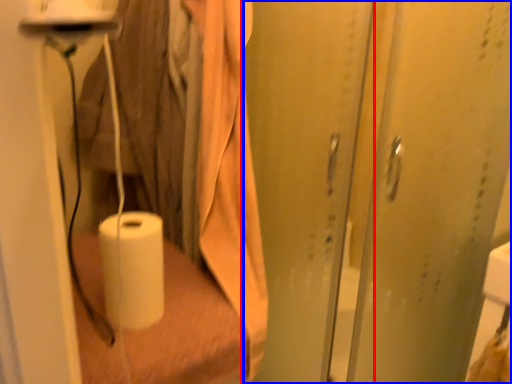
Question: Which object appears closest to the camera in this image, screen door (highlighted by a red box) or screen door (highlighted by a blue box)?

Choices:
 (A) screen door
 (B) screen door

Answer: (A)